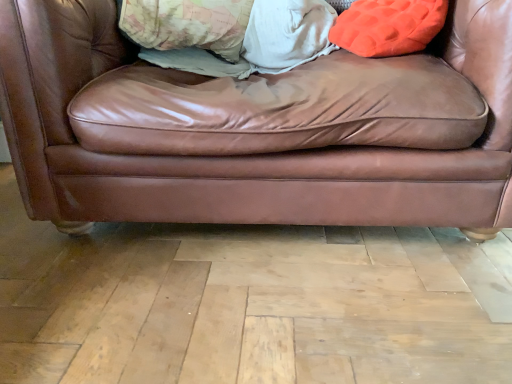
Question: Is orange fuzzy pillow at upper right inside or outside of patterned fabric pillow at upper center?

Choices:
 (A) inside
 (B) outside

Answer: (B)

Question: Is point (356, 39) positioned closer to the camera than point (137, 9)?

Choices:
 (A) closer
 (B) farther

Answer: (A)

Question: Based on their relative distances, which object is nearer to the orange fuzzy pillow at upper right?

Choices:
 (A) patterned fabric pillow at upper center
 (B) brown leather couch at center

Answer: (B)

Question: Which is nearer to the patterned fabric pillow at upper center?

Choices:
 (A) orange fuzzy pillow at upper right
 (B) brown leather couch at center

Answer: (B)